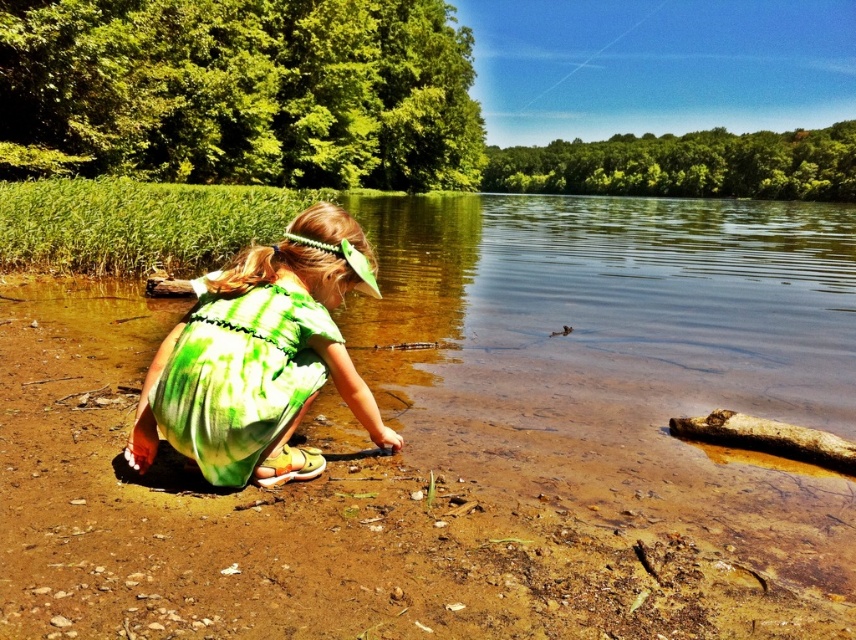
Does brown dirt at lower left appear under brown rough log at lower right?

Yes, brown dirt at lower left is below brown rough log at lower right.

How far apart are brown dirt at lower left and brown rough log at lower right?

The distance of brown dirt at lower left from brown rough log at lower right is 12.09 inches.

Between point (51, 451) and point (767, 451), which one is positioned behind?

Positioned behind is point (767, 451).

The image size is (856, 640). Find the location of `brown dirt at lower left`. brown dirt at lower left is located at coordinates (390, 509).

From the picture: Who is more distant from viewer, (400, 480) or (290, 410)?

The point (400, 480) is behind.

Who is taller, brown dirt at lower left or green tie-dye dress at lower center?

green tie-dye dress at lower center is taller.

Between point (158, 472) and point (241, 300), which one is positioned behind?

The point (158, 472) is behind.

Identify the location of brown dirt at lower left. (390, 509).

Who is more distant from viewer, (x=214, y=312) or (x=756, y=435)?

Positioned behind is point (x=756, y=435).

Describe the element at coordinates (241, 376) in the screenshot. This screenshot has height=640, width=856. I see `green tie-dye dress at lower center` at that location.

Where is `green tie-dye dress at lower center`? Image resolution: width=856 pixels, height=640 pixels. green tie-dye dress at lower center is located at coordinates [241, 376].